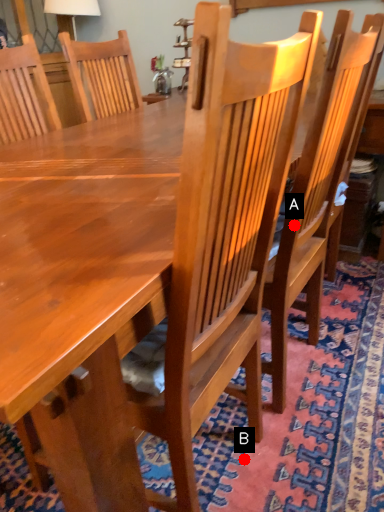
Question: Two points are circled on the image, labeled by A and B beside each circle. Among these points, which one is nearest to the camera?

Choices:
 (A) A is closer
 (B) B is closer

Answer: (A)